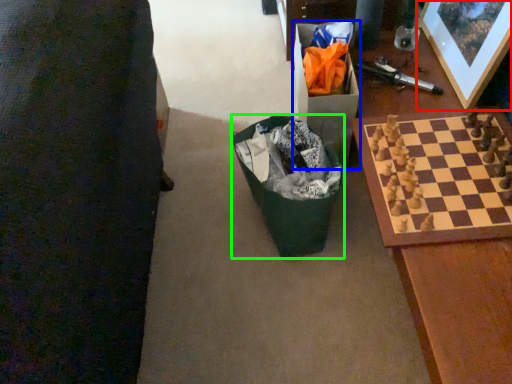
Question: Based on their relative distances, which object is nearer to picture frame (highlighted by a red box)? Choose from cardboard box (highlighted by a blue box) and recycling bin (highlighted by a green box).

Choices:
 (A) cardboard box
 (B) recycling bin

Answer: (A)